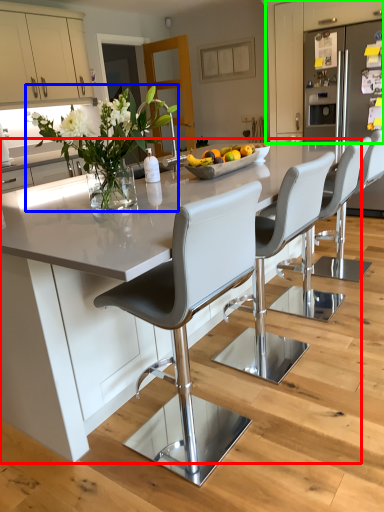
Question: Which object is the closest to the kitchen & dining room table (highlighted by a red box)? Choose among these: floral arrangement (highlighted by a blue box) or cabinetry (highlighted by a green box).

Choices:
 (A) floral arrangement
 (B) cabinetry

Answer: (A)